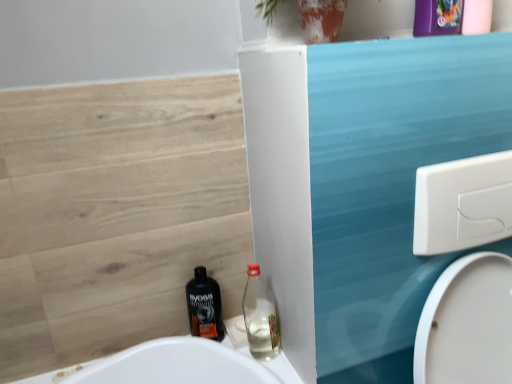
What do you see at coordinates (204, 306) in the screenshot? I see `black plastic bottle at lower center, marked as the second bottle in a right-to-left arrangement` at bounding box center [204, 306].

The image size is (512, 384). What are the coordinates of `black plastic bottle at lower center, marked as the second bottle in a right-to-left arrangement` in the screenshot? It's located at (204, 306).

Locate an element on the screen. This screenshot has width=512, height=384. clear glass bottle at lower center, which appears as the first bottle when viewed from the right is located at coordinates (260, 317).

What do you see at coordinates (260, 317) in the screenshot?
I see `clear glass bottle at lower center, which appears as the first bottle when viewed from the right` at bounding box center [260, 317].

What are the coordinates of `black plastic bottle at lower center, marked as the second bottle in a right-to-left arrangement` in the screenshot? It's located at (204, 306).

In the image, is black plastic bottle at lower center, marked as the second bottle in a right-to-left arrangement, on the left side or the right side of clear glass bottle at lower center, which is the second bottle in left-to-right order?

Based on their positions, black plastic bottle at lower center, marked as the second bottle in a right-to-left arrangement, is located to the left of clear glass bottle at lower center, which is the second bottle in left-to-right order.

Considering the positions of objects black plastic bottle at lower center, the 1th bottle when ordered from left to right, and clear glass bottle at lower center, which is the second bottle in left-to-right order, in the image provided, who is in front, black plastic bottle at lower center, the 1th bottle when ordered from left to right, or clear glass bottle at lower center, which is the second bottle in left-to-right order,?

clear glass bottle at lower center, which is the second bottle in left-to-right order, is closer to the camera.

Is point (193, 293) farther from viewer compared to point (246, 302)?

No, it is in front of (246, 302).

From the image's perspective, between black plastic bottle at lower center, marked as the second bottle in a right-to-left arrangement, and clear glass bottle at lower center, which appears as the first bottle when viewed from the right, who is located below?

black plastic bottle at lower center, marked as the second bottle in a right-to-left arrangement, is shown below in the image.

From a real-world perspective, does black plastic bottle at lower center, the 1th bottle when ordered from left to right, stand above clear glass bottle at lower center, which appears as the first bottle when viewed from the right?

No.

Looking at this image, between black plastic bottle at lower center, the 1th bottle when ordered from left to right, and clear glass bottle at lower center, which appears as the first bottle when viewed from the right, which one has larger width?

black plastic bottle at lower center, the 1th bottle when ordered from left to right, is wider.

Between black plastic bottle at lower center, the 1th bottle when ordered from left to right, and clear glass bottle at lower center, which appears as the first bottle when viewed from the right, which one has more height?

Standing taller between the two is black plastic bottle at lower center, the 1th bottle when ordered from left to right.

Is black plastic bottle at lower center, marked as the second bottle in a right-to-left arrangement, smaller than clear glass bottle at lower center, which appears as the first bottle when viewed from the right?

Yes, black plastic bottle at lower center, marked as the second bottle in a right-to-left arrangement, is smaller than clear glass bottle at lower center, which appears as the first bottle when viewed from the right.

Do you think black plastic bottle at lower center, the 1th bottle when ordered from left to right, is within clear glass bottle at lower center, which is the second bottle in left-to-right order, or outside of it?

black plastic bottle at lower center, the 1th bottle when ordered from left to right, is spatially situated outside clear glass bottle at lower center, which is the second bottle in left-to-right order.

Is black plastic bottle at lower center, the 1th bottle when ordered from left to right, in contact with clear glass bottle at lower center, which is the second bottle in left-to-right order?

black plastic bottle at lower center, the 1th bottle when ordered from left to right, is not next to clear glass bottle at lower center, which is the second bottle in left-to-right order, and they're not touching.

Is black plastic bottle at lower center, marked as the second bottle in a right-to-left arrangement, oriented towards clear glass bottle at lower center, which is the second bottle in left-to-right order?

No, black plastic bottle at lower center, marked as the second bottle in a right-to-left arrangement, is not facing towards clear glass bottle at lower center, which is the second bottle in left-to-right order.

Where is `bottle that appears below the clear glass bottle at lower center, which is the second bottle in left-to-right order (from the image's perspective)`? The width and height of the screenshot is (512, 384). bottle that appears below the clear glass bottle at lower center, which is the second bottle in left-to-right order (from the image's perspective) is located at coordinates (204, 306).

Considering the relative positions of clear glass bottle at lower center, which is the second bottle in left-to-right order, and black plastic bottle at lower center, the 1th bottle when ordered from left to right, in the image provided, is clear glass bottle at lower center, which is the second bottle in left-to-right order, to the right of black plastic bottle at lower center, the 1th bottle when ordered from left to right, from the viewer's perspective?

Yes, clear glass bottle at lower center, which is the second bottle in left-to-right order, is to the right of black plastic bottle at lower center, the 1th bottle when ordered from left to right.

Is the position of clear glass bottle at lower center, which appears as the first bottle when viewed from the right, more distant than that of black plastic bottle at lower center, the 1th bottle when ordered from left to right?

That is False.

Which is farther, [246,292] or [205,272]?

The point [246,292] is farther.

From the image's perspective, which object appears higher, clear glass bottle at lower center, which is the second bottle in left-to-right order, or black plastic bottle at lower center, the 1th bottle when ordered from left to right?

clear glass bottle at lower center, which is the second bottle in left-to-right order.

From a real-world perspective, is clear glass bottle at lower center, which appears as the first bottle when viewed from the right, physically located above or below black plastic bottle at lower center, marked as the second bottle in a right-to-left arrangement?

From a real-world perspective, clear glass bottle at lower center, which appears as the first bottle when viewed from the right, is physically above black plastic bottle at lower center, marked as the second bottle in a right-to-left arrangement.

Looking at their sizes, would you say clear glass bottle at lower center, which is the second bottle in left-to-right order, is wider or thinner than black plastic bottle at lower center, the 1th bottle when ordered from left to right?

Clearly, clear glass bottle at lower center, which is the second bottle in left-to-right order, has less width compared to black plastic bottle at lower center, the 1th bottle when ordered from left to right.

Who is shorter, clear glass bottle at lower center, which appears as the first bottle when viewed from the right, or black plastic bottle at lower center, marked as the second bottle in a right-to-left arrangement?

With less height is clear glass bottle at lower center, which appears as the first bottle when viewed from the right.

Which of these two, clear glass bottle at lower center, which appears as the first bottle when viewed from the right, or black plastic bottle at lower center, the 1th bottle when ordered from left to right, is smaller?

black plastic bottle at lower center, the 1th bottle when ordered from left to right.

Which is correct: clear glass bottle at lower center, which appears as the first bottle when viewed from the right, is inside black plastic bottle at lower center, the 1th bottle when ordered from left to right, or outside of it?

clear glass bottle at lower center, which appears as the first bottle when viewed from the right, is outside black plastic bottle at lower center, the 1th bottle when ordered from left to right.

Are clear glass bottle at lower center, which is the second bottle in left-to-right order, and black plastic bottle at lower center, the 1th bottle when ordered from left to right, located far from each other?

clear glass bottle at lower center, which is the second bottle in left-to-right order, is near black plastic bottle at lower center, the 1th bottle when ordered from left to right, not far away.

Is clear glass bottle at lower center, which appears as the first bottle when viewed from the right, oriented away from black plastic bottle at lower center, the 1th bottle when ordered from left to right?

No, clear glass bottle at lower center, which appears as the first bottle when viewed from the right, is not facing the opposite direction of black plastic bottle at lower center, the 1th bottle when ordered from left to right.

Can you tell me how much clear glass bottle at lower center, which appears as the first bottle when viewed from the right, and black plastic bottle at lower center, marked as the second bottle in a right-to-left arrangement, differ in facing direction?

The angular difference between clear glass bottle at lower center, which appears as the first bottle when viewed from the right, and black plastic bottle at lower center, marked as the second bottle in a right-to-left arrangement, is 0.000105 degrees.

Identify the location of bottle that appears above the black plastic bottle at lower center, marked as the second bottle in a right-to-left arrangement (from a real-world perspective). (260, 317).

I want to click on bottle above the black plastic bottle at lower center, the 1th bottle when ordered from left to right (from the image's perspective), so click(x=260, y=317).

The width and height of the screenshot is (512, 384). I want to click on bottle below the clear glass bottle at lower center, which appears as the first bottle when viewed from the right (from a real-world perspective), so click(x=204, y=306).